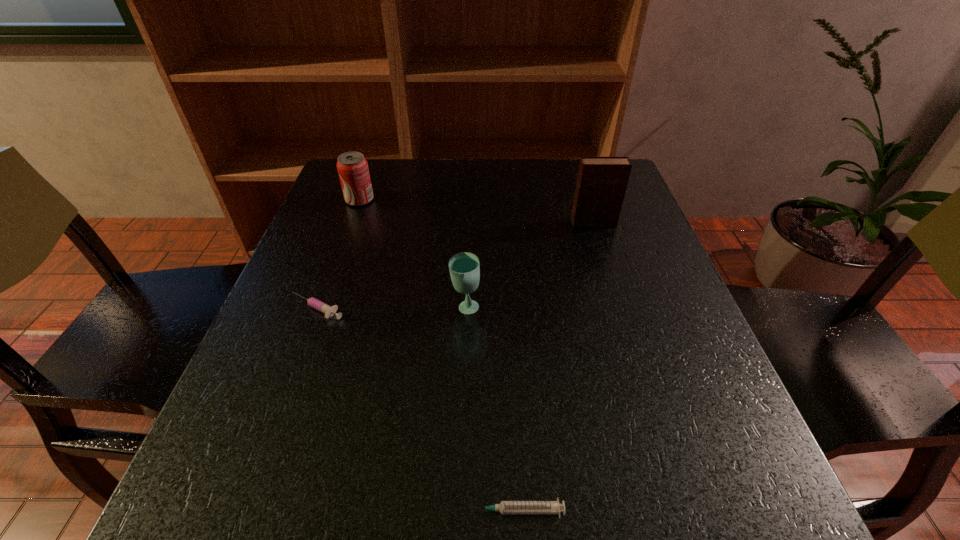
Where is `the rightmost object`? This screenshot has height=540, width=960. the rightmost object is located at coordinates (601, 184).

Where is `the fourth nearest object`? Image resolution: width=960 pixels, height=540 pixels. the fourth nearest object is located at coordinates (601, 184).

The width and height of the screenshot is (960, 540). What are the coordinates of `soda can` in the screenshot? It's located at (352, 167).

Identify the location of glass. (464, 267).

Locate an element on the screen. The width and height of the screenshot is (960, 540). the farther syringe is located at coordinates (328, 310).

Find the location of `the nearer syringe`. the nearer syringe is located at coordinates (505, 507).

What are the coordinates of `the right syringe` in the screenshot? It's located at [505, 507].

You are a GUI agent. You are given a task and a screenshot of the screen. Output one action in this format:
    pyautogui.click(x=<x>, y=<y>)
    Task: Click on the vacant space located on the front cover of the diary
    
    Given the screenshot: What is the action you would take?
    (x=619, y=306)

You are a GUI agent. You are given a task and a screenshot of the screen. Output one action in this format:
    pyautogui.click(x=<x>, y=<y>)
    Task: Click on the vacant space situated 0.150m on the front of the farthest object
    The height and width of the screenshot is (540, 960).
    Given the screenshot: What is the action you would take?
    pyautogui.click(x=344, y=245)

The height and width of the screenshot is (540, 960). Find the location of `free space located 0.060m on the back of the glass`. free space located 0.060m on the back of the glass is located at coordinates (467, 278).